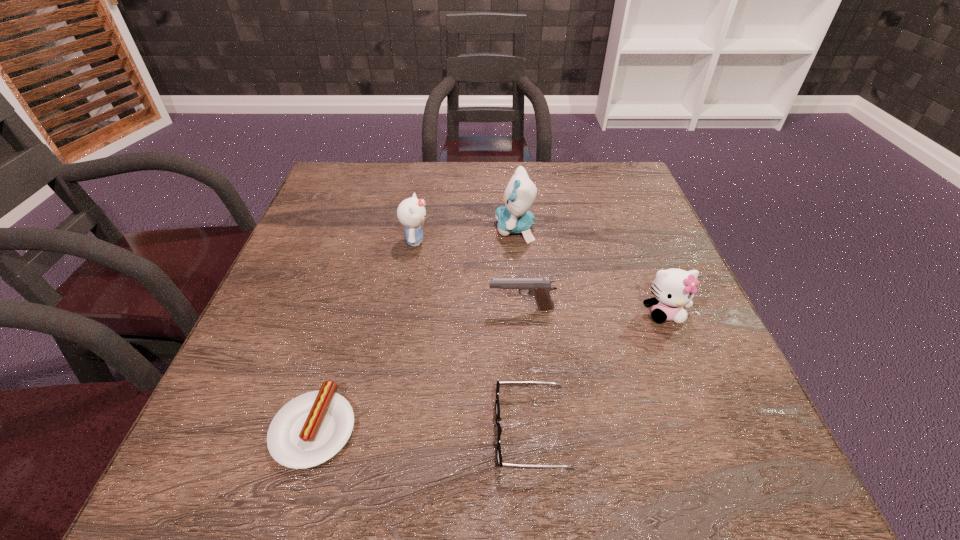
I want to click on free space located on the right of the shortest object, so click(465, 428).

Locate an element on the screen. This screenshot has width=960, height=540. spectacles positioned at the near edge is located at coordinates (497, 406).

I want to click on sausage situated at the near edge, so coord(312,428).

Find the location of a particular element. The width and height of the screenshot is (960, 540). object that is at the left edge is located at coordinates (312, 428).

Where is `object located at the right edge`? The height and width of the screenshot is (540, 960). object located at the right edge is located at coordinates (673, 288).

The height and width of the screenshot is (540, 960). I want to click on object present at the near left corner, so click(x=312, y=428).

Where is `vacant region at the far edge of the desktop`? vacant region at the far edge of the desktop is located at coordinates pyautogui.click(x=420, y=188).

You are a GUI agent. You are given a task and a screenshot of the screen. Output one action in this format:
    pyautogui.click(x=<x>, y=<y>)
    Task: Click on the vacant space at the near edge of the desktop
    
    Given the screenshot: What is the action you would take?
    point(495,474)

Identify the location of vacant space at the left edge. (301, 272).

I want to click on vacant region at the right edge of the desktop, so click(x=644, y=222).